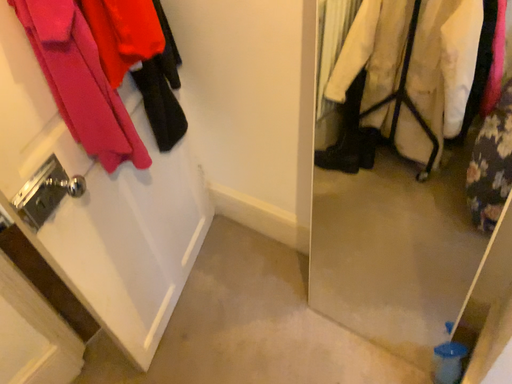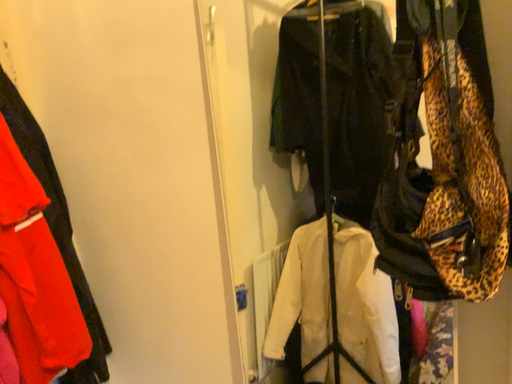
Question: How did the camera likely rotate when shooting the video?

Choices:
 (A) rotated downward
 (B) rotated upward

Answer: (B)